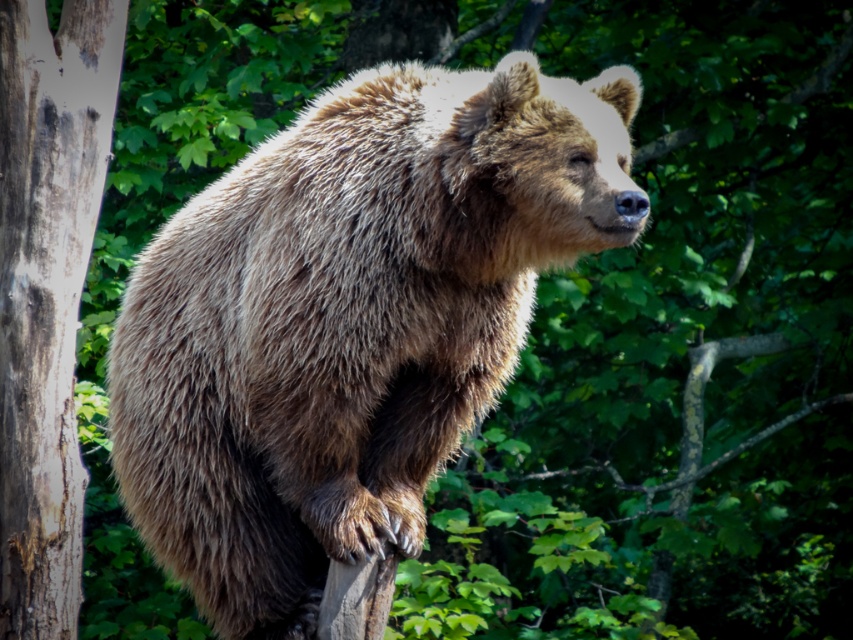
You are a wildlife photographer aiming to capture a closeup of the smooth gray bark at left while avoiding the fuzzy brown bear at center. Since the bear is blocking the view, can you determine if you can crouch down to get the shot without the bear being in the way?

The fuzzy brown bear at center is shorter than the smooth gray bark at left, so if you crouch down below the bear height, you can take the photo without the bear blocking the view.

You are a photographer trying to capture a clear photo of the smooth gray bark at left. However, the fuzzy brown bear at center is blocking your view. Can you move to the side to get an unobstructed shot?

The fuzzy brown bear at center is in front of the smooth gray bark at left, so moving to the side should allow you to see around the bear and get an unobstructed view of the smooth gray bark at left.